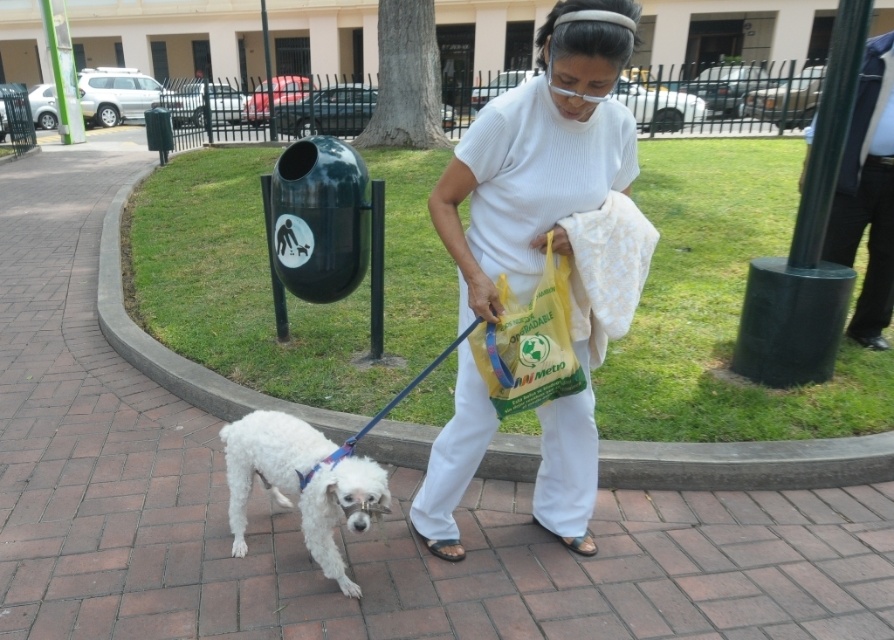
Question: Can you confirm if white ribbed shirt at center is bigger than white fluffy dog at lower left?

Choices:
 (A) no
 (B) yes

Answer: (B)

Question: Does white ribbed shirt at center have a greater width compared to white fluffy dog at lower left?

Choices:
 (A) yes
 (B) no

Answer: (B)

Question: Does white ribbed shirt at center have a smaller size compared to white fluffy dog at lower left?

Choices:
 (A) yes
 (B) no

Answer: (B)

Question: Which point is closer to the camera?

Choices:
 (A) white fluffy dog at lower left
 (B) white ribbed shirt at center

Answer: (B)

Question: Which of the following is the farthest from the observer?

Choices:
 (A) white ribbed shirt at center
 (B) white fluffy dog at lower left

Answer: (B)